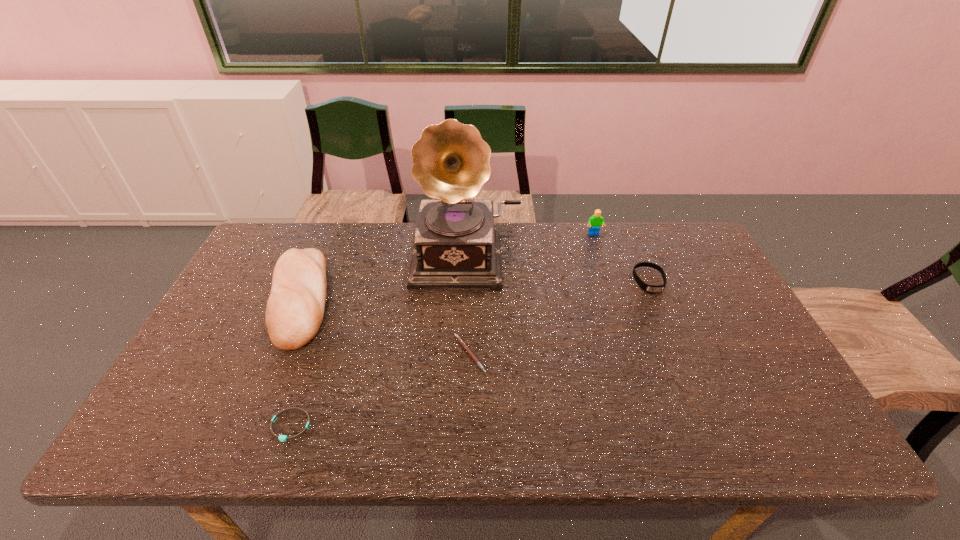
Identify the location of record player. (455, 243).

The height and width of the screenshot is (540, 960). I want to click on Lego, so tap(596, 220).

You are a GUI agent. You are given a task and a screenshot of the screen. Output one action in this format:
    pyautogui.click(x=<x>, y=<y>)
    Task: Click on the bread
    This screenshot has height=540, width=960.
    Given the screenshot: What is the action you would take?
    pyautogui.click(x=295, y=308)

The height and width of the screenshot is (540, 960). I want to click on the third shortest object, so click(x=648, y=288).

Locate an element on the screen. The image size is (960, 540). the farther wristband is located at coordinates tap(648, 288).

Find the location of a particular element. pen is located at coordinates (459, 339).

Find the location of `the nearer wristband`. the nearer wristband is located at coordinates (282, 438).

Find the location of a particular element. The width and height of the screenshot is (960, 540). the nearest object is located at coordinates (282, 438).

You are a GUI agent. You are given a task and a screenshot of the screen. Output one action in this format:
    pyautogui.click(x=<x>, y=<y>)
    Task: Click on the free region located 0.350m on the horn of the tallest object
    The width and height of the screenshot is (960, 540).
    Given the screenshot: What is the action you would take?
    pyautogui.click(x=463, y=392)

I want to click on free space located on the face of the second object from right to left, so click(620, 316).